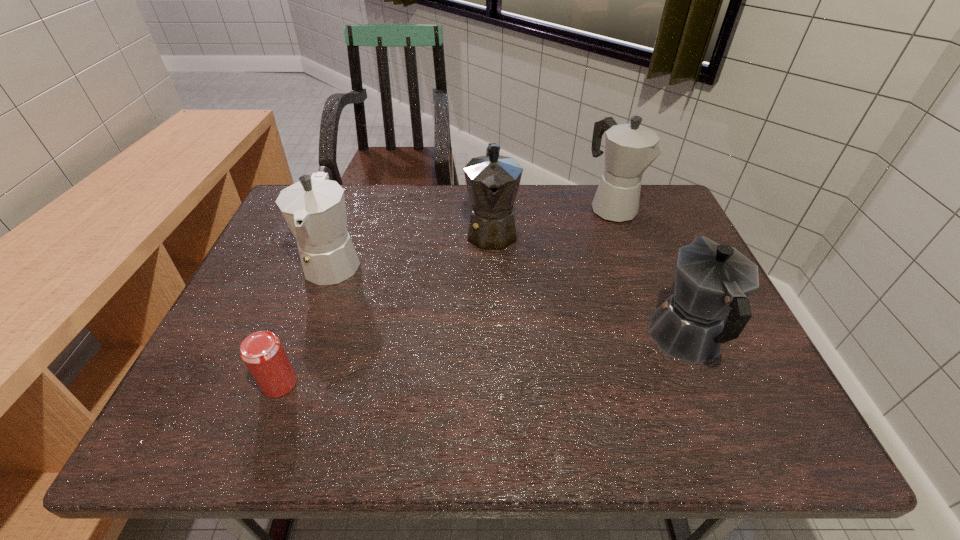
Identify the location of coffeepot that is the fourth closest to the shortest object. (629, 148).